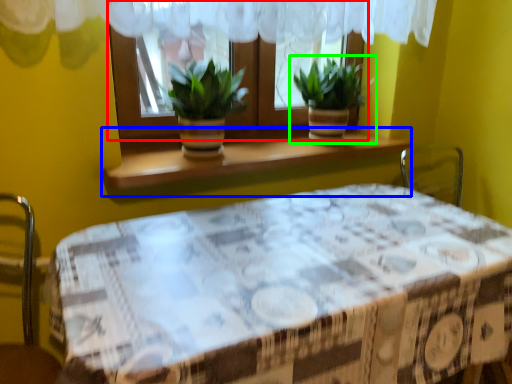
Question: Based on their relative distances, which object is farther from window (highlighted by a red box)? Choose from window sill (highlighted by a blue box) and houseplant (highlighted by a green box).

Choices:
 (A) window sill
 (B) houseplant

Answer: (A)